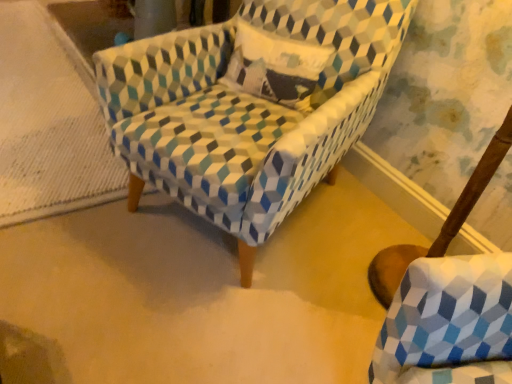
Question: Does textured fabric armchair at center have a larger size compared to textured fabric swivel chair at lower right?

Choices:
 (A) no
 (B) yes

Answer: (B)

Question: From the image's perspective, is textured fabric armchair at center located beneath textured fabric swivel chair at lower right?

Choices:
 (A) yes
 (B) no

Answer: (B)

Question: Would you consider textured fabric armchair at center to be distant from textured fabric swivel chair at lower right?

Choices:
 (A) no
 (B) yes

Answer: (A)

Question: Is textured fabric armchair at center positioned before textured fabric swivel chair at lower right?

Choices:
 (A) yes
 (B) no

Answer: (A)

Question: Does textured fabric armchair at center have a lesser height compared to textured fabric swivel chair at lower right?

Choices:
 (A) no
 (B) yes

Answer: (A)

Question: Is textured fabric armchair at center surrounding textured fabric swivel chair at lower right?

Choices:
 (A) no
 (B) yes

Answer: (A)

Question: Considering the relative sizes of textured fabric swivel chair at lower right and textured fabric armchair at center in the image provided, is textured fabric swivel chair at lower right taller than textured fabric armchair at center?

Choices:
 (A) yes
 (B) no

Answer: (B)

Question: Considering the relative sizes of textured fabric swivel chair at lower right and textured fabric armchair at center in the image provided, is textured fabric swivel chair at lower right wider than textured fabric armchair at center?

Choices:
 (A) yes
 (B) no

Answer: (B)

Question: Can you confirm if textured fabric swivel chair at lower right is shorter than textured fabric armchair at center?

Choices:
 (A) no
 (B) yes

Answer: (B)

Question: From the image's perspective, is textured fabric swivel chair at lower right on textured fabric armchair at center?

Choices:
 (A) yes
 (B) no

Answer: (B)

Question: Is textured fabric swivel chair at lower right directly adjacent to textured fabric armchair at center?

Choices:
 (A) yes
 (B) no

Answer: (B)

Question: Can you confirm if textured fabric swivel chair at lower right is smaller than textured fabric armchair at center?

Choices:
 (A) no
 (B) yes

Answer: (B)

Question: Is textured cotton pillow at center positioned before textured fabric swivel chair at lower right?

Choices:
 (A) no
 (B) yes

Answer: (B)